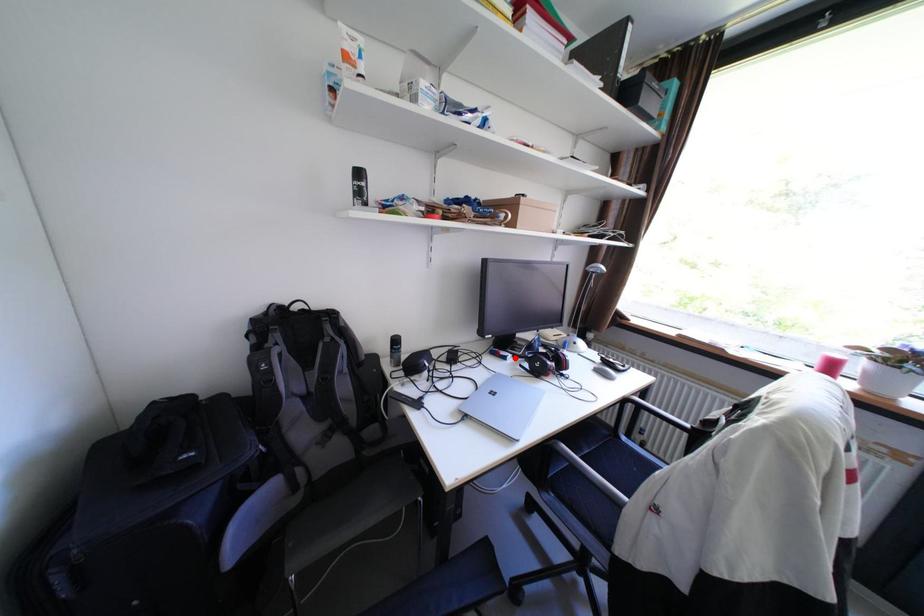
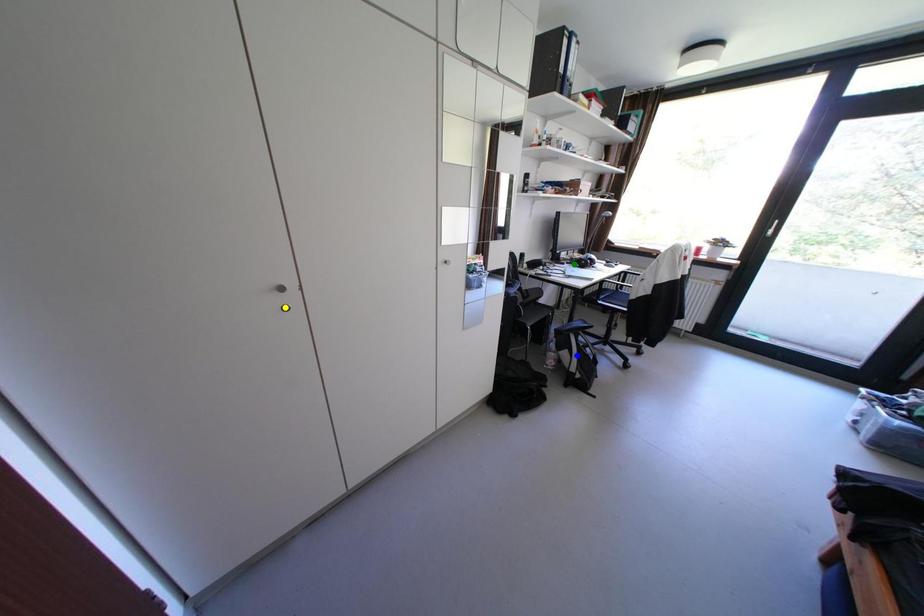
Question: I am providing you with two images of the same scene from different viewpoints. A red point is marked on the first image. You are given multiple points on the second image. Which point in image 2 is actually the same real-world point as the red point in image 1?

Choices:
 (A) yellow point
 (B) green point
 (C) blue point

Answer: (B)